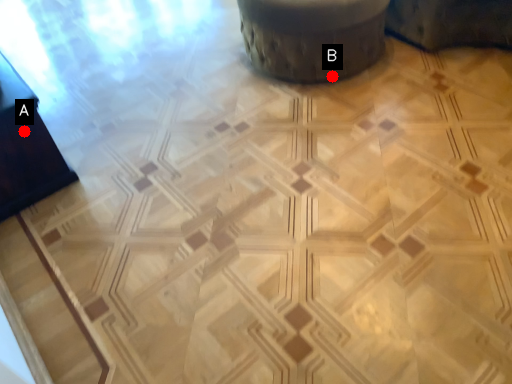
Question: Two points are circled on the image, labeled by A and B beside each circle. Which point appears farthest from the camera in this image?

Choices:
 (A) A is further
 (B) B is further

Answer: (B)